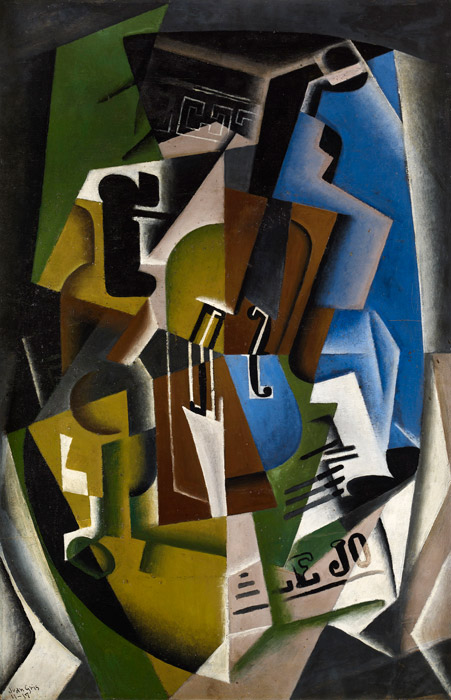
What are the coordinates of `blue paint` in the screenshot? It's located at (268, 426).